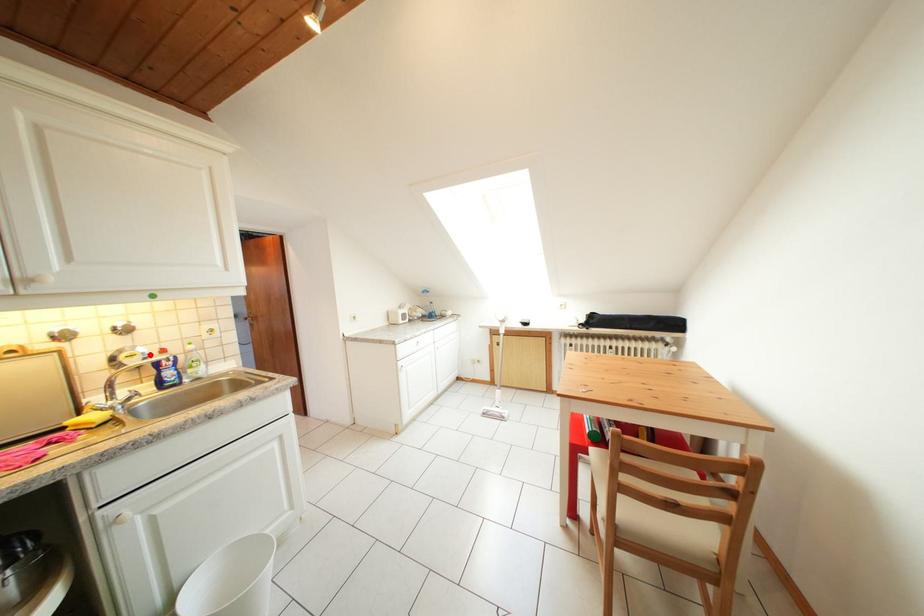
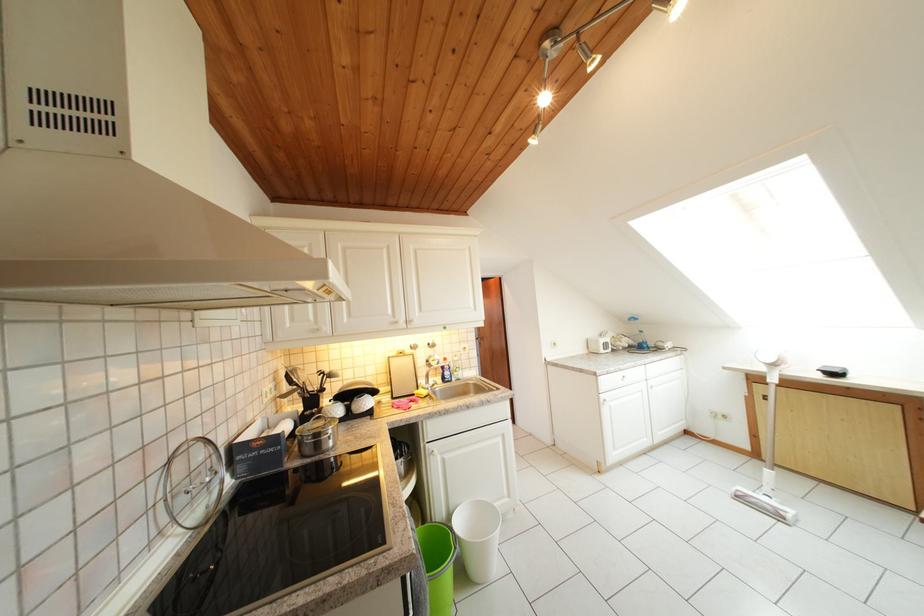
Locate, in the second image, the point that corresponds to the highlighted location in the first image.

(445, 362)